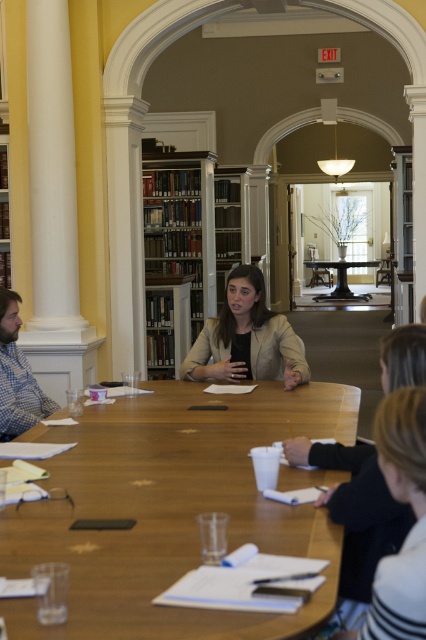
Does wooden table at center have a larger size compared to wooden bookshelf at center?

Actually, wooden table at center might be smaller than wooden bookshelf at center.

This screenshot has width=426, height=640. I want to click on wooden table at center, so click(x=170, y=509).

Find the location of a particular element. Image resolution: width=426 pixels, height=640 pixels. wooden table at center is located at coordinates (170, 509).

Measure the distance between point (227,282) and camera.

They are 5.77 meters apart.

Can you confirm if beige textured blazer at center is smaller than black metal table at center?

Yes, beige textured blazer at center is smaller than black metal table at center.

Where is `beige textured blazer at center`? Image resolution: width=426 pixels, height=640 pixels. beige textured blazer at center is located at coordinates (247, 339).

Is point (230, 348) closer to camera compared to point (2, 428)?

No, (230, 348) is further to viewer.

Between beige textured blazer at center and blue plaid shirt at left, which one is positioned lower?

blue plaid shirt at left

What do you see at coordinates (247, 339) in the screenshot? I see `beige textured blazer at center` at bounding box center [247, 339].

At what (x,y) coordinates should I click in order to perform the action: click on beige textured blazer at center. Please return your answer as a coordinate pair (x, y). The height and width of the screenshot is (640, 426). Looking at the image, I should click on (247, 339).